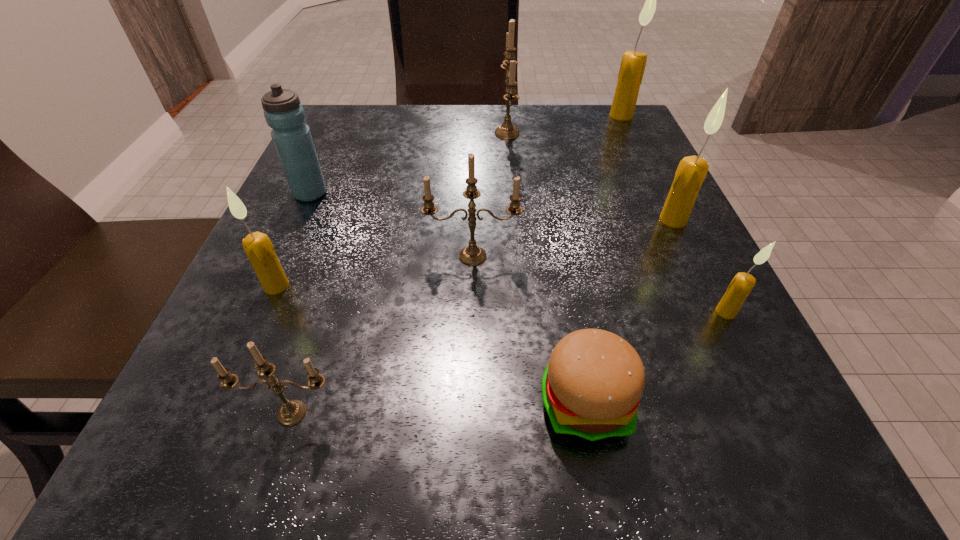
I want to click on empty space between the farthest metallic candle and the water bottle, so click(409, 163).

The height and width of the screenshot is (540, 960). Identify the location of vacant area that lies between the water bottle and the smallest metallic candle. (301, 303).

I want to click on unoccupied area between the third nearest cream candle and the smallest cream candle, so click(700, 266).

Where is `free point between the fourth farthest candle and the hamburger`? free point between the fourth farthest candle and the hamburger is located at coordinates (529, 329).

This screenshot has height=540, width=960. I want to click on empty space between the water bottle and the fifth nearest object, so click(392, 225).

Find the location of a particular element. This screenshot has height=540, width=960. vacant area between the fourth farthest candle and the leftmost candle is located at coordinates (374, 271).

Identify which object is the eighth nearest to the shortest object. Please provide its 2D coordinates. Your answer should be formatted as a tuple, i.e. [(x, y)], where the tuple contains the x and y coordinates of a point satisfying the conditions above.

[(633, 63)]

Select which object appears as the fifth closest to the fifth farthest candle. Please provide its 2D coordinates. Your answer should be formatted as a tuple, i.e. [(x, y)], where the tuple contains the x and y coordinates of a point satisfying the conditions above.

[(507, 130)]

Where is `candle that stands as the closest to the second smallest cream candle`? The width and height of the screenshot is (960, 540). candle that stands as the closest to the second smallest cream candle is located at coordinates (292, 412).

Point out which candle is positioned as the sixth nearest to the seventh nearest object. Please provide its 2D coordinates. Your answer should be formatted as a tuple, i.e. [(x, y)], where the tuple contains the x and y coordinates of a point satisfying the conditions above.

[(633, 63)]